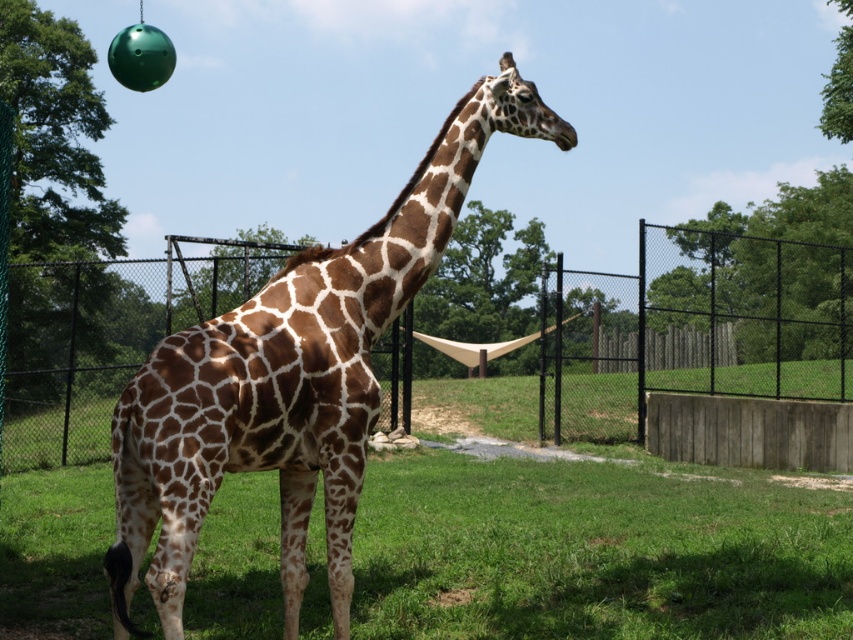
You are a zookeeper checking the enclosure. You notice the brown spotted giraffe at center and the black metal fence at center. Which object is positioned higher in the image?

The black metal fence at center is located above the brown spotted giraffe at center, so it is positioned higher in the image.

You are a zookeeper checking the enclosure. You notice the black metal fence at center and the brown spotted giraffe at center. Which object is closer to you?

The black metal fence at center is closer to you than the brown spotted giraffe at center.